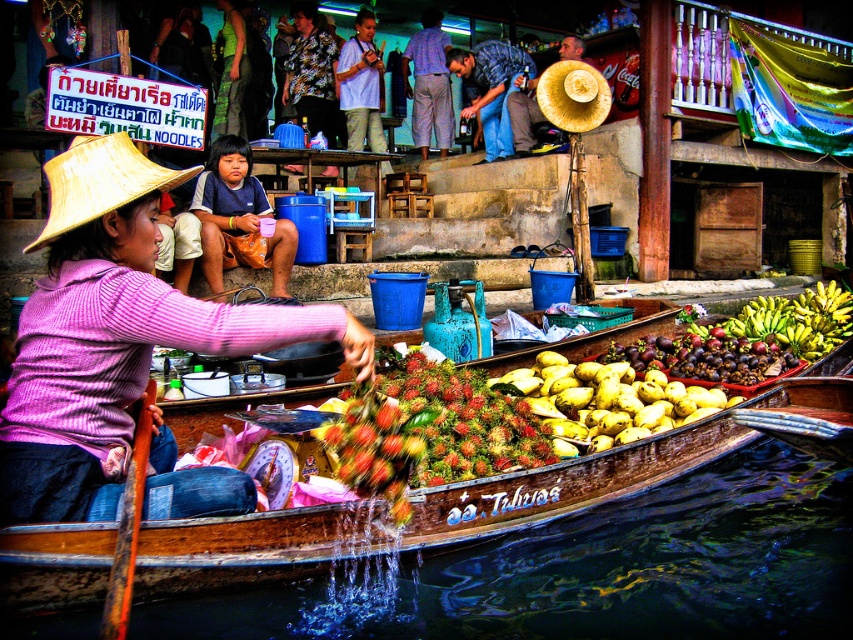
Question: Which object is the closest to the matte straw hat at upper center?

Choices:
 (A) floral shirt at upper center
 (B) green rubber bananas at right
 (C) blue jeans at center
 (D) light blue shirt at upper center

Answer: (C)

Question: Which point is farther to the camera?

Choices:
 (A) floral shirt at upper center
 (B) pink striped sweater at left

Answer: (A)

Question: Is ruddy spiky rambutan at center below purple matte mangosteen at center?

Choices:
 (A) no
 (B) yes

Answer: (B)

Question: Which object is closer to the camera taking this photo?

Choices:
 (A) bumpy textured rambutan at center
 (B) matte straw hat at upper center
 (C) natural straw hat at left

Answer: (C)

Question: Is purple matte mangosteen at center to the right of blue jeans at center from the viewer's perspective?

Choices:
 (A) no
 (B) yes

Answer: (B)

Question: Does matte brown straw hat at upper left lie in front of green rubber bananas at right?

Choices:
 (A) no
 (B) yes

Answer: (A)